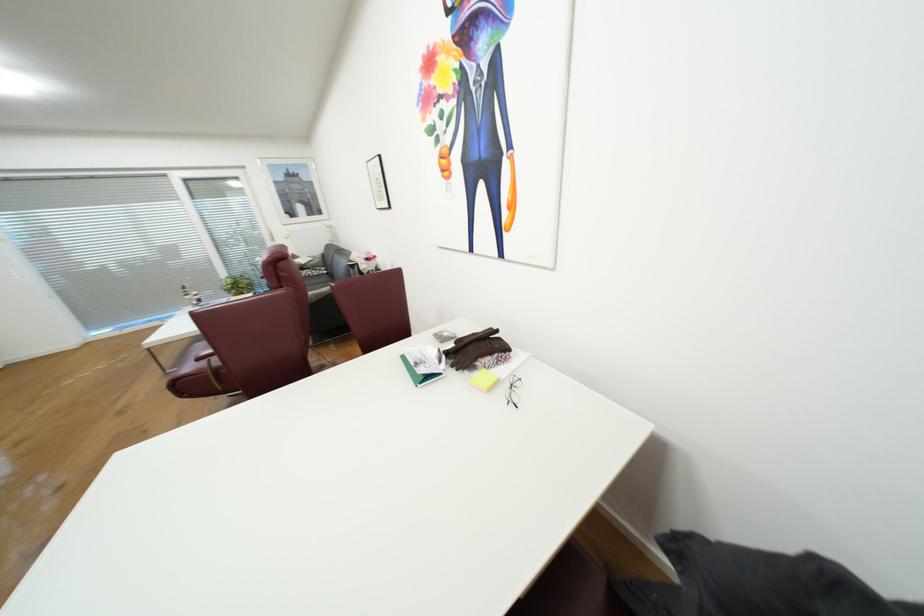
Where would you rest the red chair armrest? Please return your answer as a coordinate pair (x, y).

(208, 362)